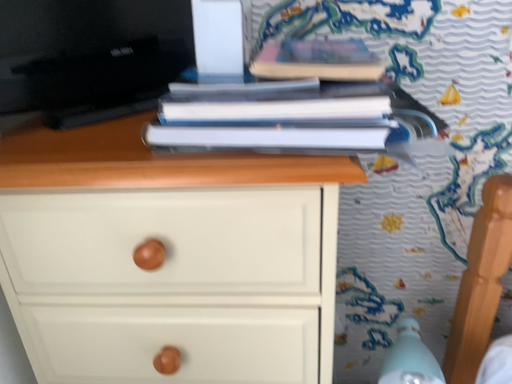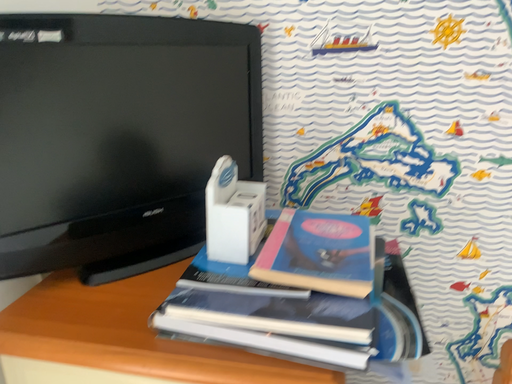
Question: How did the camera likely rotate when shooting the video?

Choices:
 (A) rotated upward
 (B) rotated downward

Answer: (A)